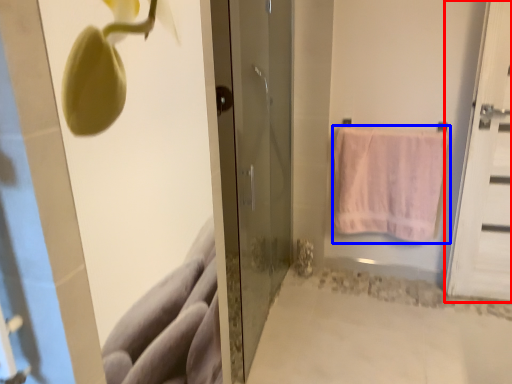
Question: Which of the following is the closest to the observer, door (highlighted by a red box) or towel (highlighted by a blue box)?

Choices:
 (A) door
 (B) towel

Answer: (A)